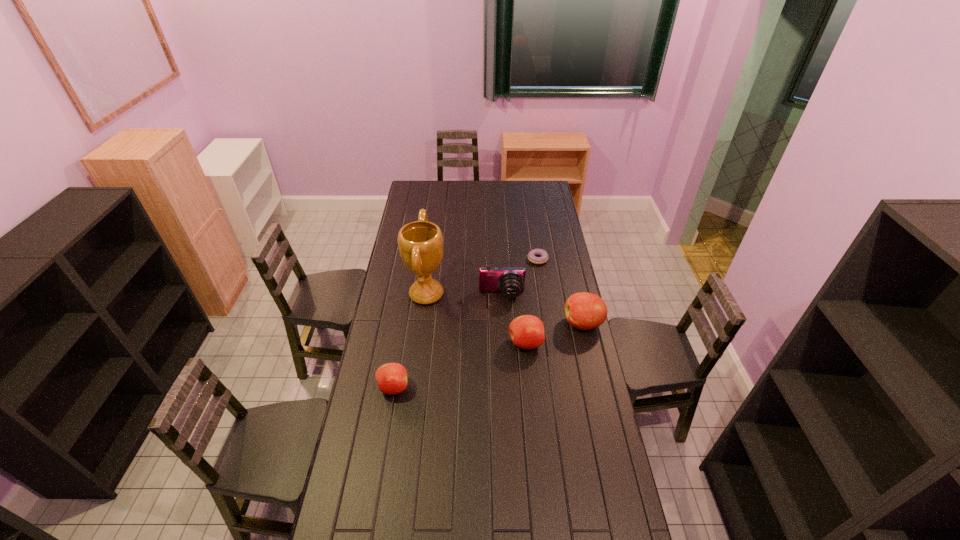
Where is `vacant space that satisfies the following two spatial constraints: 1. on the front-facing side of the rightmost object; 2. on the left side of the camera`? vacant space that satisfies the following two spatial constraints: 1. on the front-facing side of the rightmost object; 2. on the left side of the camera is located at coordinates (503, 323).

At what (x,y) coordinates should I click in order to perform the action: click on vacant region that satisfies the following two spatial constraints: 1. on the front-facing side of the camera; 2. on the left side of the rightmost apple. Please return your answer as a coordinate pair (x, y). The width and height of the screenshot is (960, 540). Looking at the image, I should click on (503, 323).